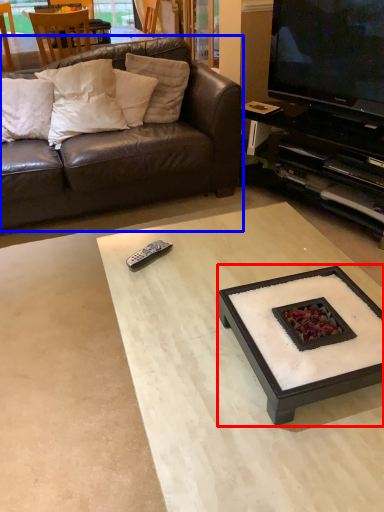
Question: Which object is closer to the camera taking this photo, coffee table (highlighted by a red box) or studio couch (highlighted by a blue box)?

Choices:
 (A) coffee table
 (B) studio couch

Answer: (A)